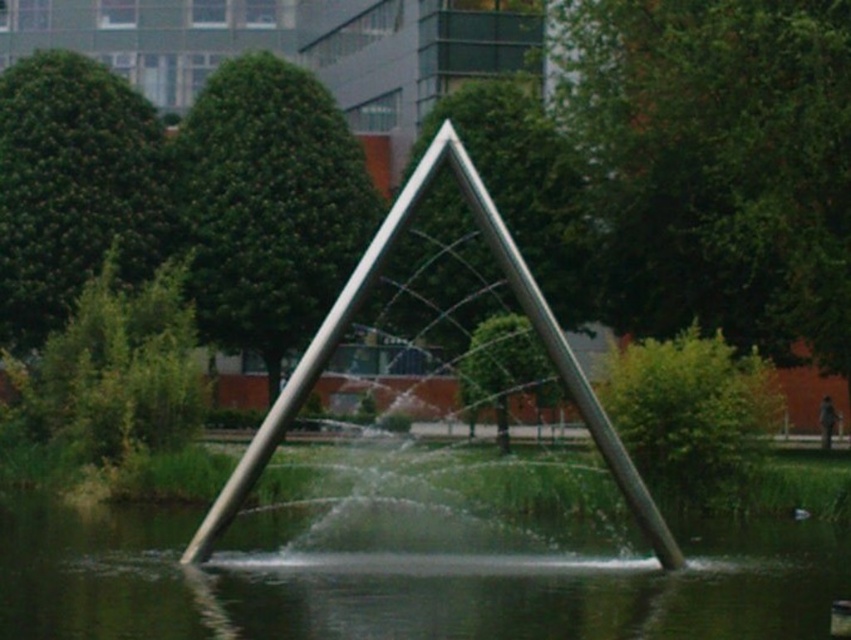
From the picture: You are an artist planning to photograph the polished metal fountain at center and the clear water at center. Which object should you focus on if you want to capture the larger subject in your photo?

The polished metal fountain at center is larger than the clear water at center, so you should focus on the polished metal fountain at center to capture the larger subject in your photo.

You are designing a small garden and want to place a similar sculpture. Given that the clear water at center is wider than the polished metal fountain at center, how should you adjust the size of the water feature relative to the fountain structure?

Since the clear water at center is wider than the polished metal fountain at center, you should design the water feature to be larger in width compared to the fountain structure to maintain the same proportional relationship.

You are standing in front of the sculpture and want to know if the clear water at center can fully cover the polished metal fountain at center. Based on the scene description, what can you conclude?

The clear water at center has a lesser height compared to polished metal fountain at center, so the water cannot fully cover the fountain.